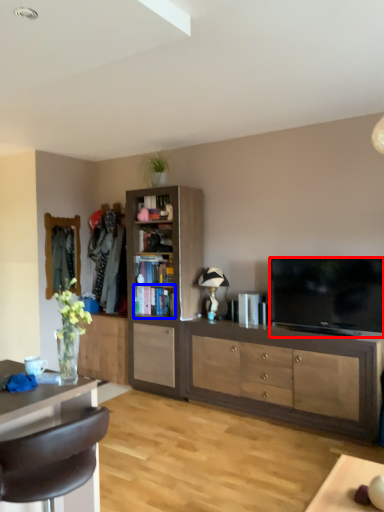
Question: Which of the following is the closest to the observer, television (highlighted by a red box) or shelf (highlighted by a blue box)?

Choices:
 (A) television
 (B) shelf

Answer: (A)